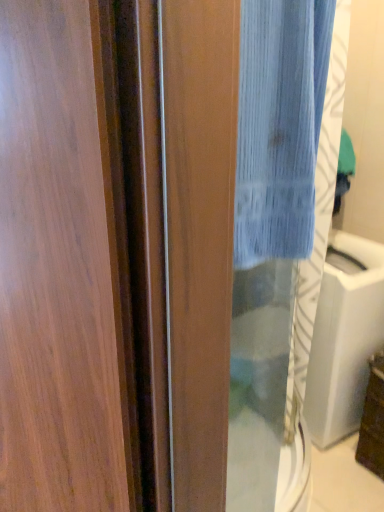
Question: Can you confirm if blue textured fabric at center is smaller than transparent glass sink at center?

Choices:
 (A) no
 (B) yes

Answer: (B)

Question: Is the surface of blue textured fabric at center in direct contact with transparent glass sink at center?

Choices:
 (A) no
 (B) yes

Answer: (A)

Question: Considering the relative sizes of blue textured fabric at center and transparent glass sink at center in the image provided, is blue textured fabric at center thinner than transparent glass sink at center?

Choices:
 (A) yes
 (B) no

Answer: (A)

Question: Is transparent glass sink at center at the back of blue textured fabric at center?

Choices:
 (A) no
 (B) yes

Answer: (A)

Question: From the image's perspective, is blue textured fabric at center located beneath transparent glass sink at center?

Choices:
 (A) yes
 (B) no

Answer: (B)

Question: Is blue textured fabric at center bigger or smaller than transparent glass sink at center?

Choices:
 (A) big
 (B) small

Answer: (B)

Question: Is blue textured fabric at center wider or thinner than transparent glass sink at center?

Choices:
 (A) wide
 (B) thin

Answer: (B)

Question: In the image, is blue textured fabric at center on the left side or the right side of transparent glass sink at center?

Choices:
 (A) left
 (B) right

Answer: (A)

Question: Is blue textured fabric at center inside the boundaries of transparent glass sink at center, or outside?

Choices:
 (A) inside
 (B) outside

Answer: (B)

Question: Considering the positions of point click(x=220, y=293) and point click(x=314, y=330), is point click(x=220, y=293) closer or farther from the camera than point click(x=314, y=330)?

Choices:
 (A) farther
 (B) closer

Answer: (B)

Question: Is wooden screen door at left taller or shorter than transparent glass sink at center?

Choices:
 (A) short
 (B) tall

Answer: (B)

Question: From the image's perspective, relative to transparent glass sink at center, is wooden screen door at left above or below?

Choices:
 (A) below
 (B) above

Answer: (B)

Question: In terms of width, does wooden screen door at left look wider or thinner when compared to transparent glass sink at center?

Choices:
 (A) thin
 (B) wide

Answer: (B)

Question: Considering the positions of blue textured fabric at center and wooden screen door at left in the image, is blue textured fabric at center taller or shorter than wooden screen door at left?

Choices:
 (A) short
 (B) tall

Answer: (A)

Question: Is blue textured fabric at center bigger or smaller than wooden screen door at left?

Choices:
 (A) small
 (B) big

Answer: (A)